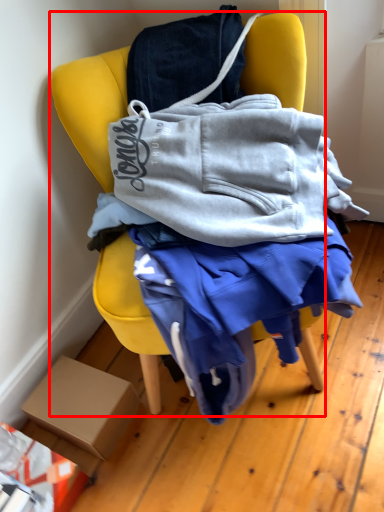
Question: Observing the image, what is the correct spatial positioning of chair (annotated by the red box) in reference to box?

Choices:
 (A) left
 (B) right

Answer: (B)